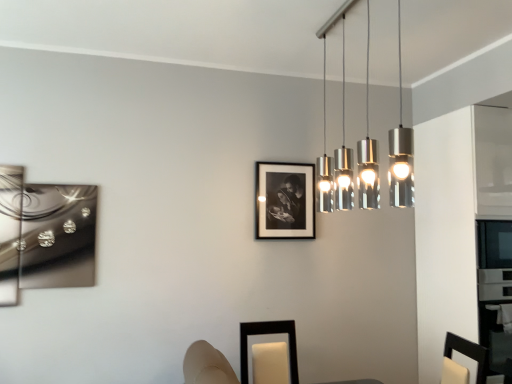
Question: Considering the positions of point (x=330, y=26) and point (x=288, y=342), is point (x=330, y=26) closer or farther from the camera than point (x=288, y=342)?

Choices:
 (A) closer
 (B) farther

Answer: (A)

Question: Would you say silver metallic pendant lights at upper center is inside or outside black matte picture frame at lower center, the 2th picture frame when ordered from right to left?

Choices:
 (A) inside
 (B) outside

Answer: (B)

Question: Considering the real-world distances, which object is closest to the black matte picture frame at lower center, which ranks as the third picture frame in top-to-bottom order?

Choices:
 (A) metallic silver abstract art at left, which is the 2th picture frame in back-to-front order
 (B) black matte picture frame at center, positioned as the 1th picture frame in back-to-front order
 (C) silver metallic pendant lights at upper center

Answer: (B)

Question: Which of these objects is positioned closest to the black matte picture frame at center, positioned as the 1th picture frame in back-to-front order?

Choices:
 (A) metallic silver abstract art at left, arranged as the 2th picture frame when viewed from the top
 (B) black matte picture frame at lower center, the first picture frame positioned from the front
 (C) silver metallic pendant lights at upper center

Answer: (B)